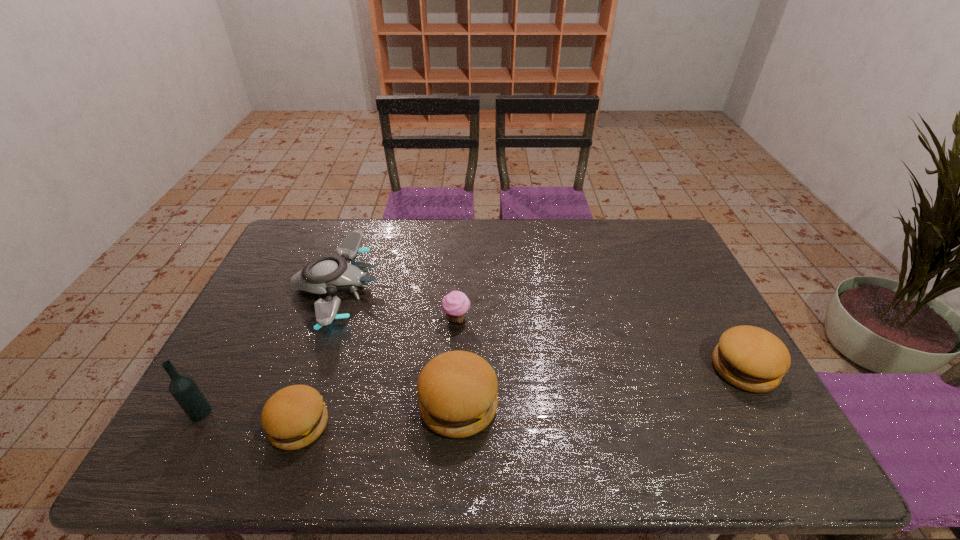
Locate an element on the screen. The image size is (960, 540). hamburger that can be found as the third closest to the tallest object is located at coordinates (750, 358).

Identify which hamburger is the second closest to the drone. Please provide its 2D coordinates. Your answer should be formatted as a tuple, i.e. [(x, y)], where the tuple contains the x and y coordinates of a point satisfying the conditions above.

[(457, 390)]